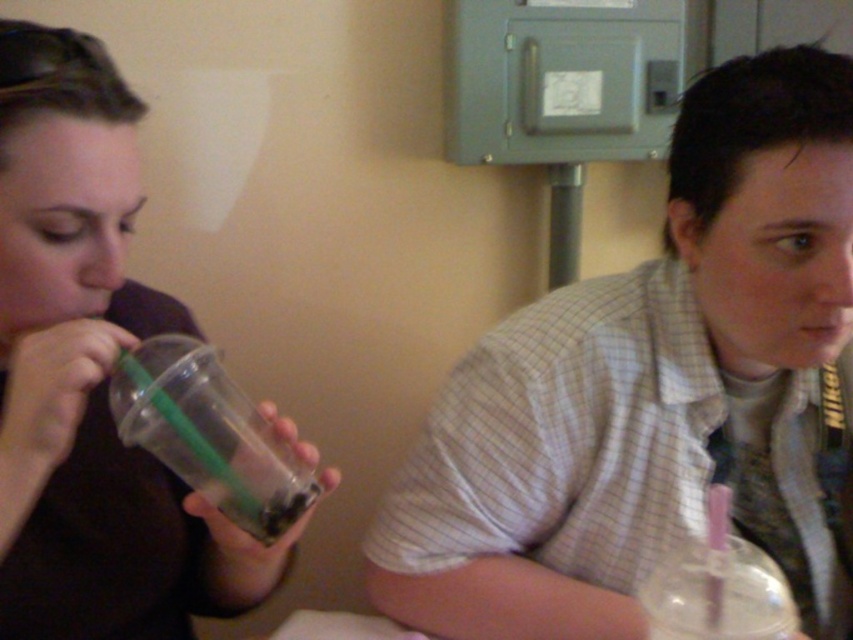
You are sitting at the table and want to grab the clear plastic cup at lower right. Can you reach it without moving the clear plastic cup at left?

The clear plastic cup at lower right is behind the clear plastic cup at left, so you cannot reach it without moving the clear plastic cup at left.